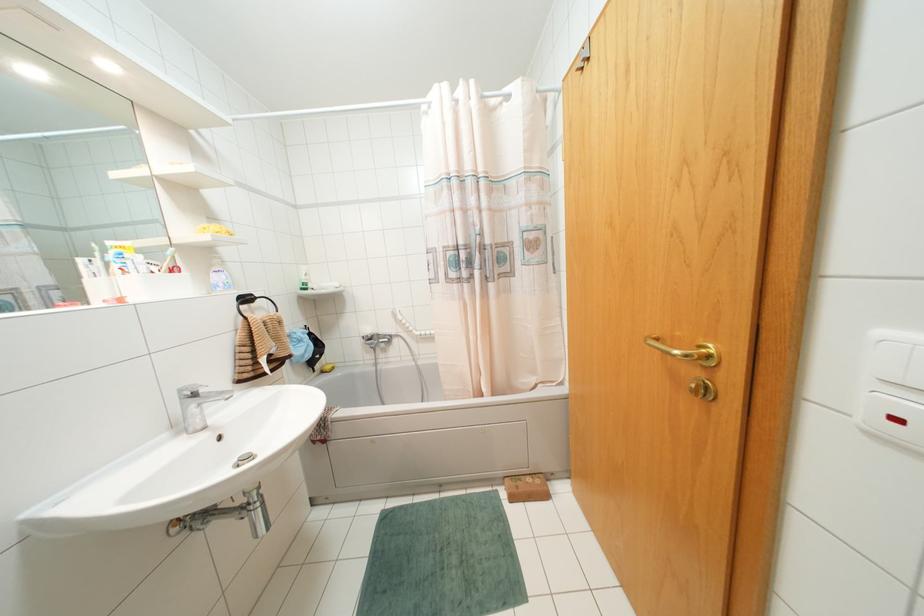
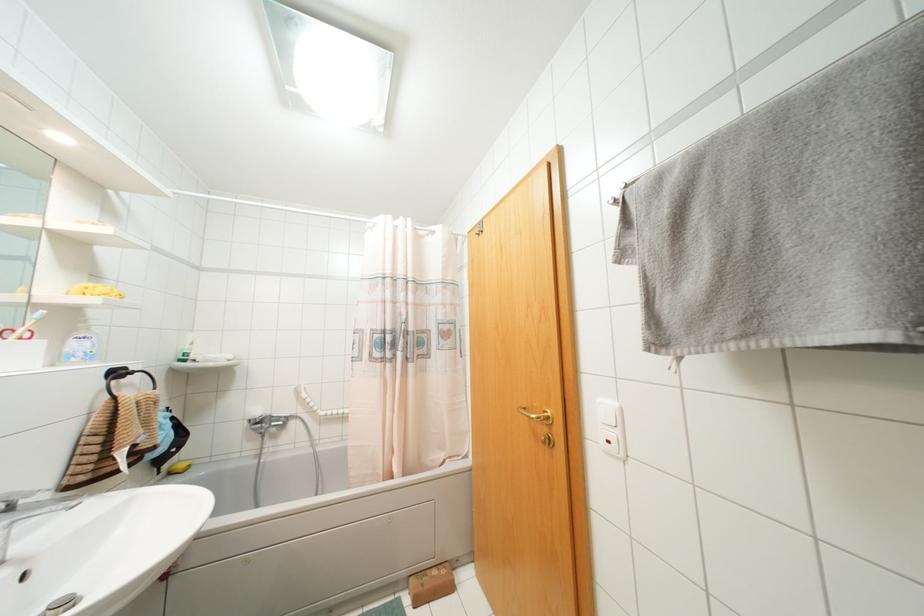
Locate, in the second image, the point that corresponds to (305,274) in the first image.

(190, 342)